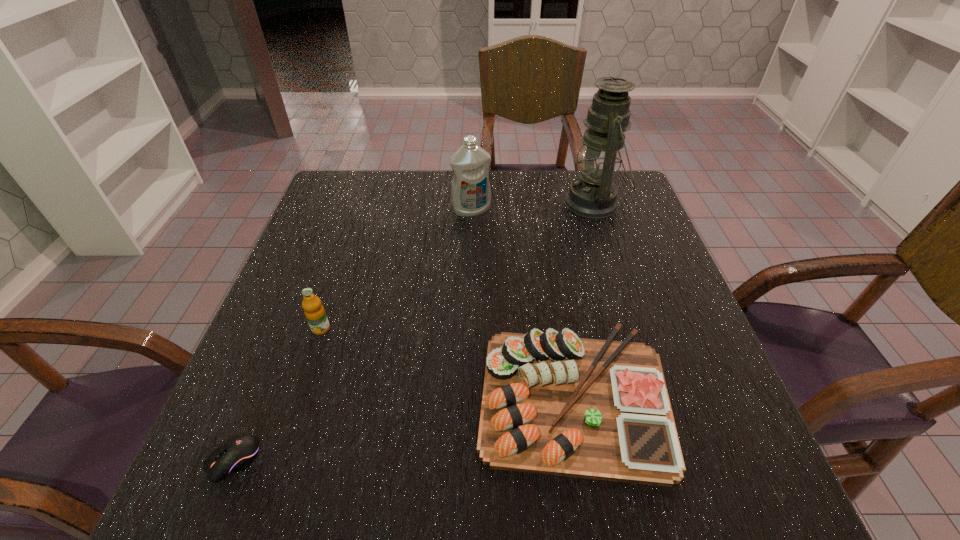
What are the coordinates of `object present at the near left corner` in the screenshot? It's located at (234, 455).

At what (x,y) coordinates should I click in order to perform the action: click on object that is at the far right corner. Please return your answer as a coordinate pair (x, y). Looking at the image, I should click on (593, 195).

At what (x,y) coordinates should I click in order to perform the action: click on object that is positioned at the near right corner. Please return your answer as a coordinate pair (x, y). Looking at the image, I should click on pos(553,403).

This screenshot has width=960, height=540. Identify the location of free space at the far edge of the desktop. (416, 193).

This screenshot has height=540, width=960. Find the location of `vacant space at the left edge of the desktop`. vacant space at the left edge of the desktop is located at coordinates (x=326, y=364).

The height and width of the screenshot is (540, 960). I want to click on vacant space at the right edge of the desktop, so click(x=686, y=388).

Find the location of a particular element. The width and height of the screenshot is (960, 540). vacant space at the far left corner of the desktop is located at coordinates (363, 211).

Find the location of a particular element. The width and height of the screenshot is (960, 540). free space between the detergent and the oil lamp is located at coordinates (533, 207).

The width and height of the screenshot is (960, 540). What are the coordinates of `free area in between the shortest object and the detergent` in the screenshot? It's located at (352, 335).

Where is `vacant point located between the detergent and the leftmost object`? The image size is (960, 540). vacant point located between the detergent and the leftmost object is located at coordinates (352, 335).